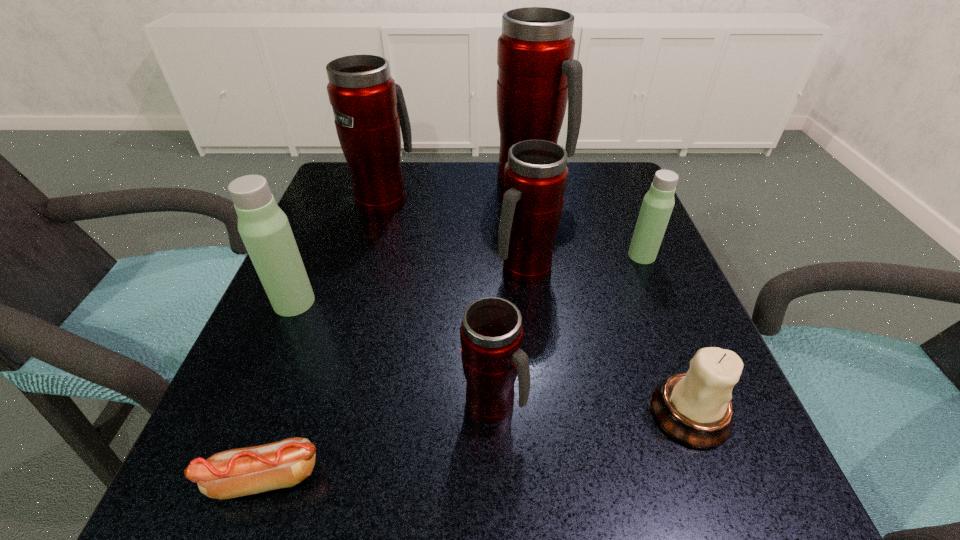
The image size is (960, 540). I want to click on object that is at the near right corner, so click(x=694, y=408).

Where is `vacant space at the far edge`? This screenshot has width=960, height=540. vacant space at the far edge is located at coordinates (418, 210).

Where is `blank space at the near edge of the desktop`? blank space at the near edge of the desktop is located at coordinates (561, 481).

In the image, there is a desktop. Find the location of `free space at the left edge`. free space at the left edge is located at coordinates pos(303,395).

What are the coordinates of `vacant space at the right edge of the desktop` in the screenshot? It's located at (650, 377).

I want to click on vacant region at the far left corner, so click(x=342, y=162).

Identify the location of free location at the near left corner. Image resolution: width=960 pixels, height=540 pixels. pyautogui.click(x=203, y=508).

This screenshot has width=960, height=540. In order to click on vacant region at the far right corner in this screenshot , I will do `click(632, 184)`.

Identify the location of empty location between the white candle holder and the smaller light thermos bottle. Image resolution: width=960 pixels, height=540 pixels. (665, 334).

At what (x,y) coordinates should I click in order to perform the action: click on vacant space that is in between the biggest red thermos bottle and the leftmost red thermos bottle. Please return your answer as a coordinate pair (x, y). The image size is (960, 540). Looking at the image, I should click on (457, 190).